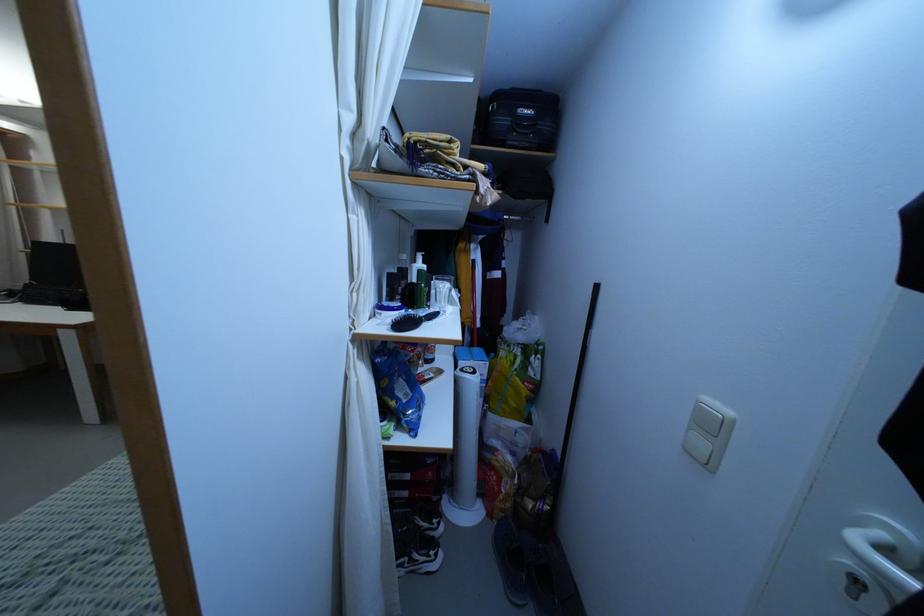
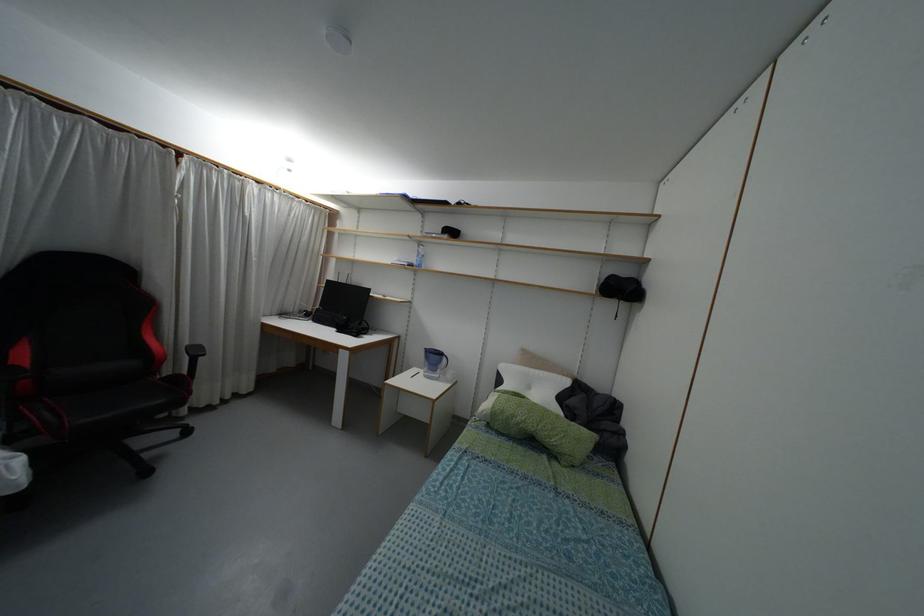
Question: Which direction would the cameraman need to move to produce the second image? Reply with the corresponding letter.

Choices:
 (A) Left
 (B) Right
 (C) Forward
 (D) Backward

Answer: (A)